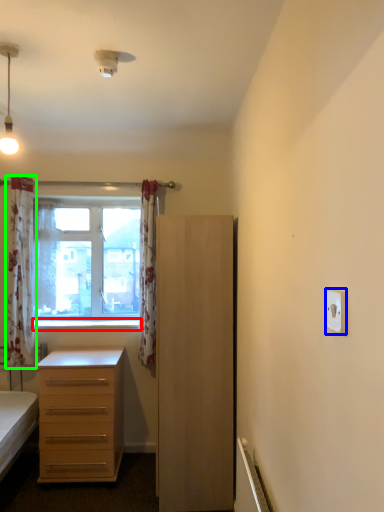
Question: Based on their relative distances, which object is farther from window sill (highlighted by a red box)? Choose from electric outlet (highlighted by a blue box) and curtain (highlighted by a green box).

Choices:
 (A) electric outlet
 (B) curtain

Answer: (A)